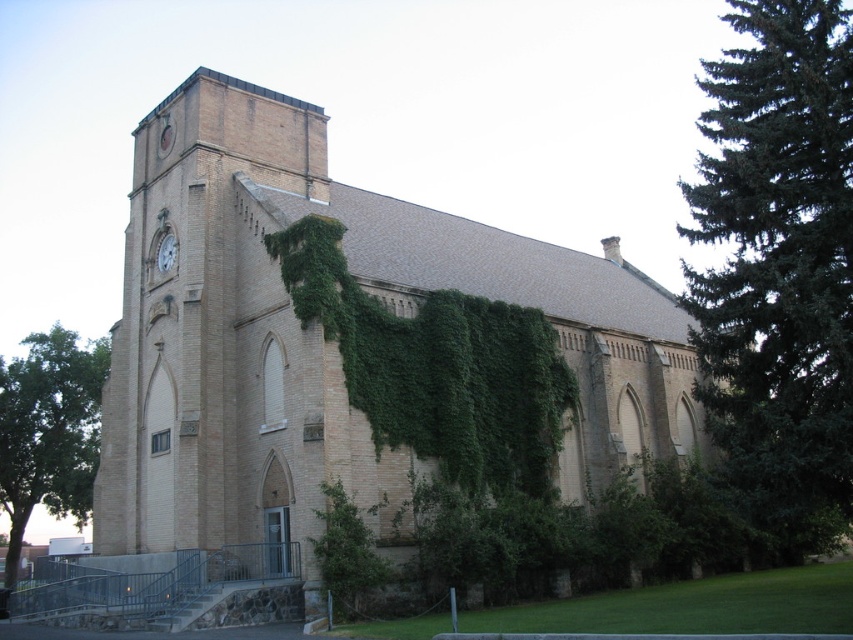
You are standing in front of the brown brick church at center and want to take a photo of it. However, there is a green leafy tree at lower left in the way. Can you still see the entire church in the photo?

A: The brown brick church at center is smaller than the green leafy tree at lower left, so the tree might block part of the church in the photo. Move closer to the church or adjust your angle to ensure the entire structure is visible.

You are standing at point (788, 257) and want to reach the entrance of the building. The entrance is located at the base of the tower on the left side. If the distance between your current position and the entrance is 47.94 meters, can you walk straight to the entrance without any obstacles?

Yes, you can walk straight to the entrance at the base of the tower on the left side because there are no obstacles mentioned in the scene description between your current position at point (788, 257) and the entrance, which is 47.94 meters away.